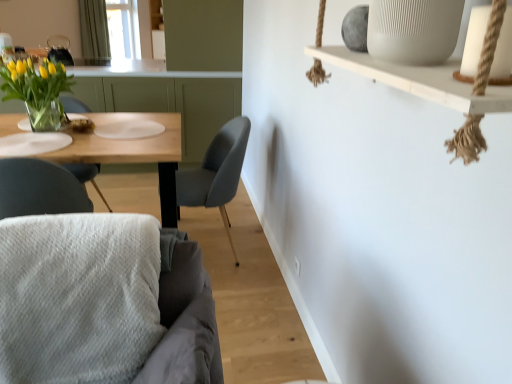
Question: From the image's perspective, is green fabric curtain at upper left above or below white textured cushion at lower left, arranged as the second chair when viewed from the back?

Choices:
 (A) above
 (B) below

Answer: (A)

Question: In terms of size, does green fabric curtain at upper left appear bigger or smaller than white textured cushion at lower left, which is the first chair in front-to-back order?

Choices:
 (A) big
 (B) small

Answer: (B)

Question: Which of these objects is positioned farthest from the white textured cushion at lower left, which is the first chair in front-to-back order?

Choices:
 (A) matte gray chair at center, the first chair viewed from the back
 (B) clear glass vase at left
 (C) green fabric curtain at upper left
 (D) wooden table at left
 (E) translucent glass vase with yellow tulips at left

Answer: (C)

Question: Estimate the real-world distances between objects in this image. Which object is farther from the white textured cushion at lower left, which is the first chair in front-to-back order?

Choices:
 (A) clear glass vase at left
 (B) wooden table at left
 (C) transparent glass window screen at upper center
 (D) matte gray chair at center, the first chair viewed from the back
 (E) green fabric curtain at upper left

Answer: (C)